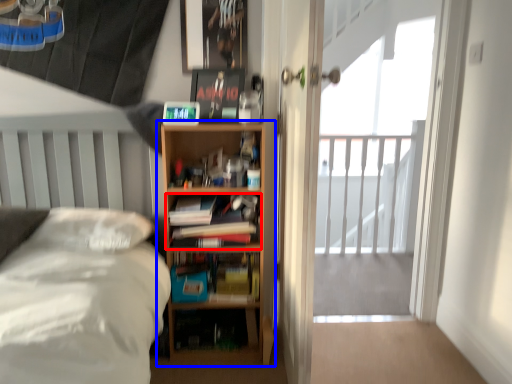
Question: Among these objects, which one is farthest to the camera, book (highlighted by a red box) or bookcase (highlighted by a blue box)?

Choices:
 (A) book
 (B) bookcase

Answer: (A)